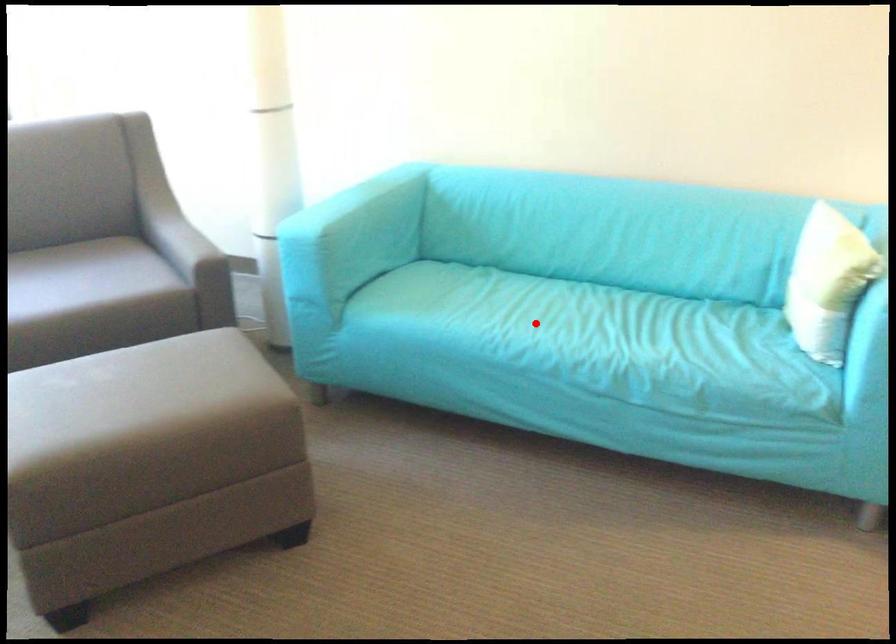
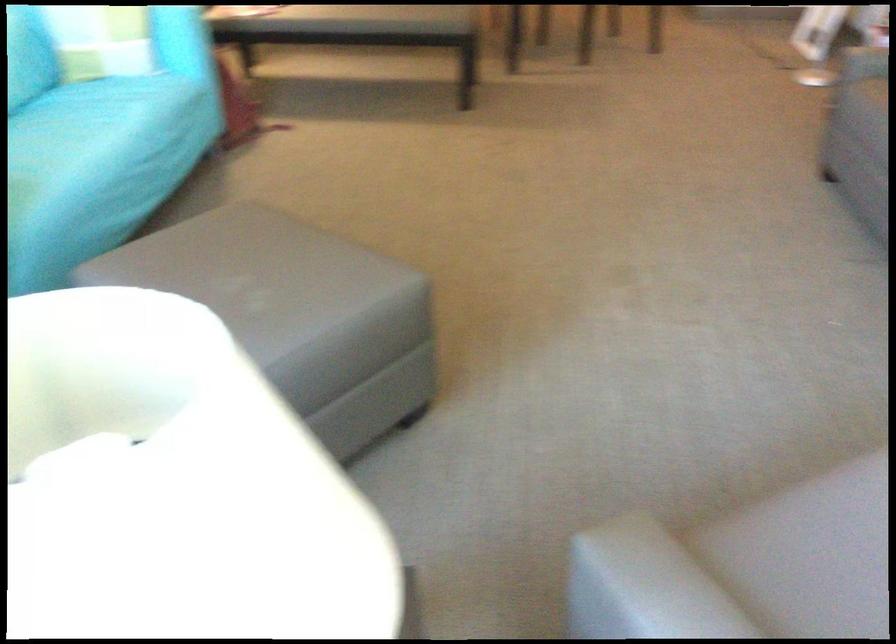
Locate, in the second image, the point that corresponds to the highlighted location in the first image.

(87, 134)